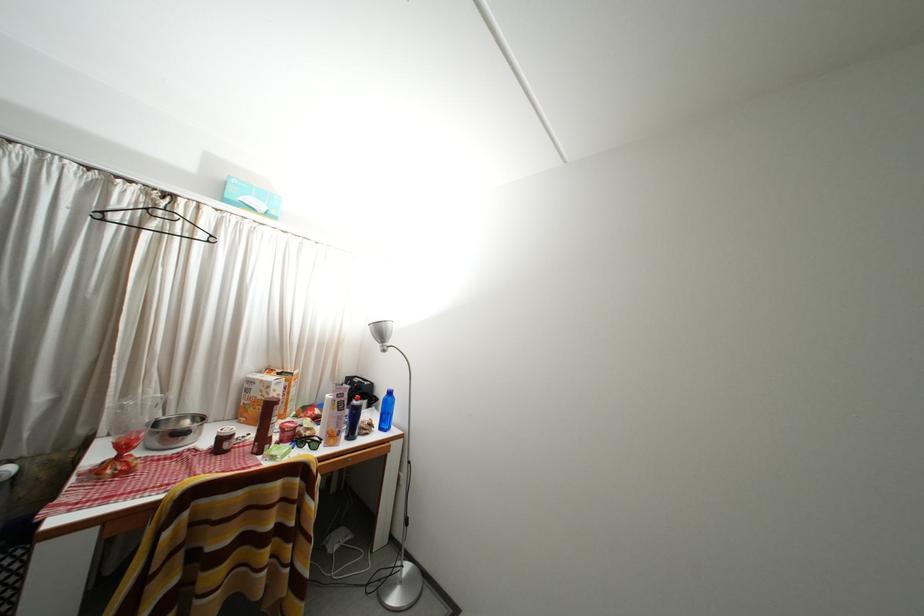
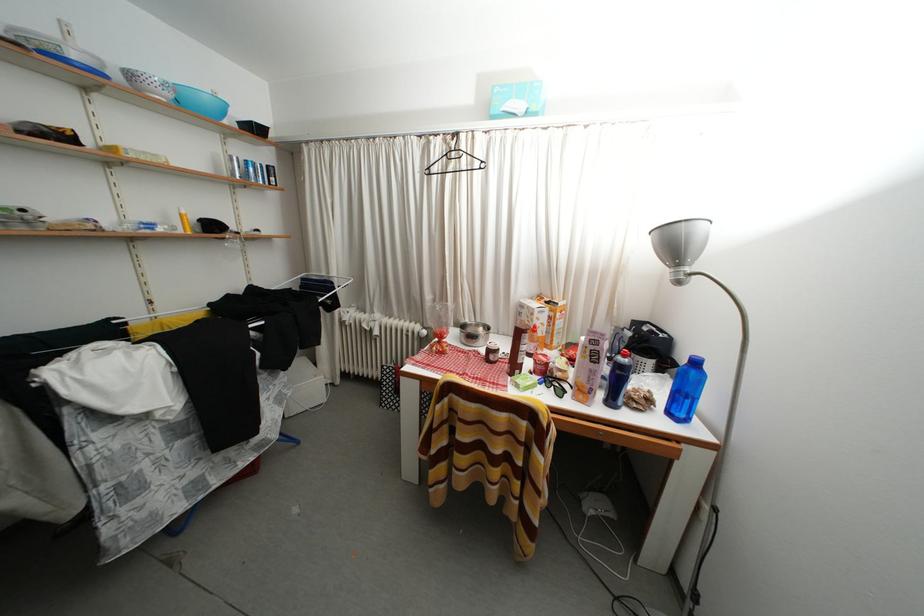
Find the pixel in the second image that matches pixel 388 434 in the first image.

(676, 419)